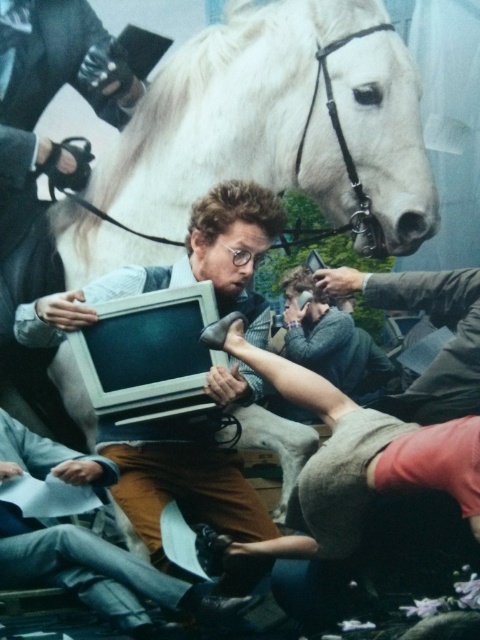
Question: Which of these objects is positioned closest to the matte gray monitor at center?

Choices:
 (A) matte plastic monitor at center
 (B) smooth gray shirt at center
 (C) matte black monitor at center

Answer: (A)

Question: Which is nearer to the smooth gray shirt at center?

Choices:
 (A) matte gray monitor at center
 (B) matte plastic monitor at center

Answer: (B)

Question: Does matte plastic monitor at center have a lesser width compared to smooth gray shirt at center?

Choices:
 (A) yes
 (B) no

Answer: (B)

Question: From the image, what is the correct spatial relationship of white glossy horse at upper center in relation to matte plastic monitor at center?

Choices:
 (A) left
 (B) right

Answer: (B)

Question: Which point is closer to the camera?

Choices:
 (A) matte black monitor at center
 (B) matte plastic monitor at center
 (C) smooth gray shirt at center

Answer: (B)

Question: Is matte black monitor at center positioned before smooth gray shirt at center?

Choices:
 (A) yes
 (B) no

Answer: (A)